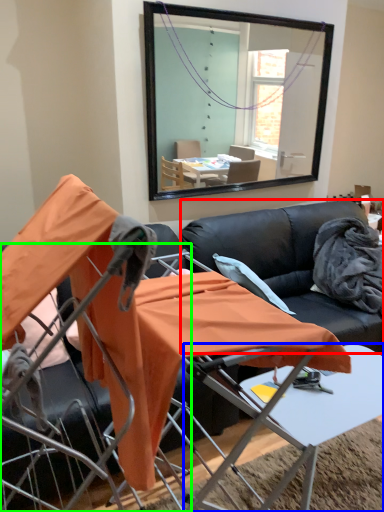
Question: Which object is positioned closest to couch (highlighted by a red box)? Select from table (highlighted by a blue box) and chair (highlighted by a green box).

Choices:
 (A) table
 (B) chair

Answer: (A)